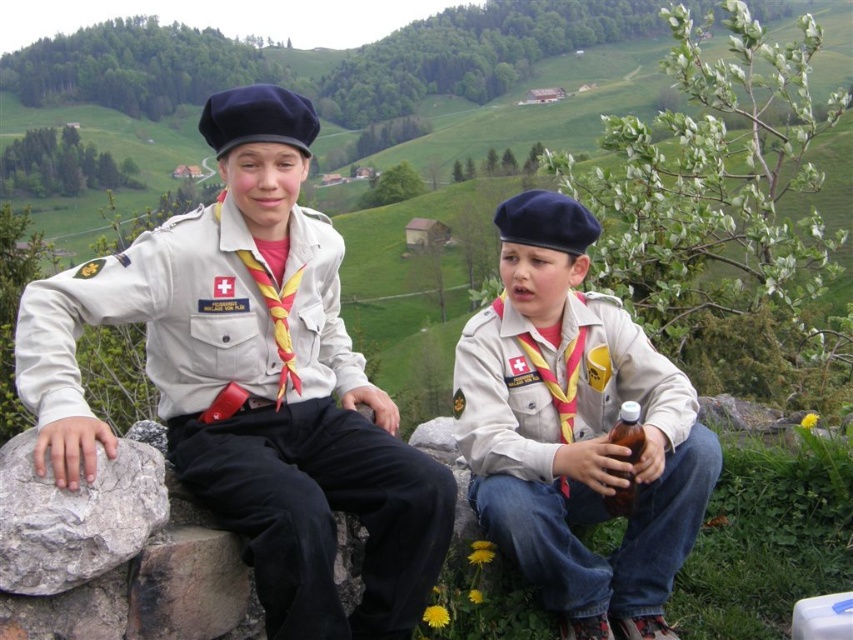
The height and width of the screenshot is (640, 853). What do you see at coordinates (579, 449) in the screenshot?
I see `matte khaki uniform at lower right` at bounding box center [579, 449].

Is point (593, 298) farther from viewer compared to point (636, 456)?

That is True.

Locate an element on the screen. Image resolution: width=853 pixels, height=640 pixels. matte khaki uniform at lower right is located at coordinates (579, 449).

Does gray rough rock at left have a larger size compared to brown glass bottle at lower right?

Yes, gray rough rock at left is bigger than brown glass bottle at lower right.

Between point (128, 502) and point (619, 490), which one is positioned in front?

Point (128, 502) is in front.

Where is `gray rough rock at left`? This screenshot has width=853, height=640. gray rough rock at left is located at coordinates (74, 516).

Between point (215, 346) and point (546, 433), which one is positioned behind?

Point (546, 433)

Who is more forward, (273, 500) or (500, 449)?

Positioned in front is point (273, 500).

Where is `matte khaki shirt at upper left`? Image resolution: width=853 pixels, height=640 pixels. matte khaki shirt at upper left is located at coordinates pos(257,408).